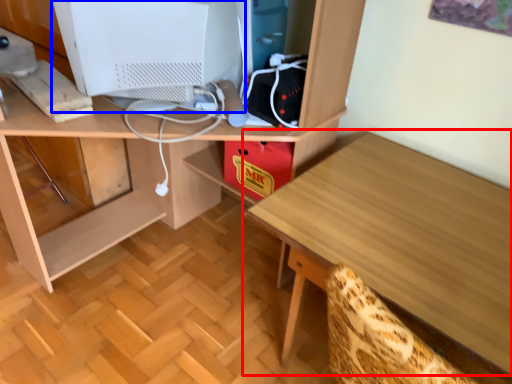
Question: Among these objects, which one is nearest to the camera, table (highlighted by a red box) or computer monitor (highlighted by a blue box)?

Choices:
 (A) table
 (B) computer monitor

Answer: (A)